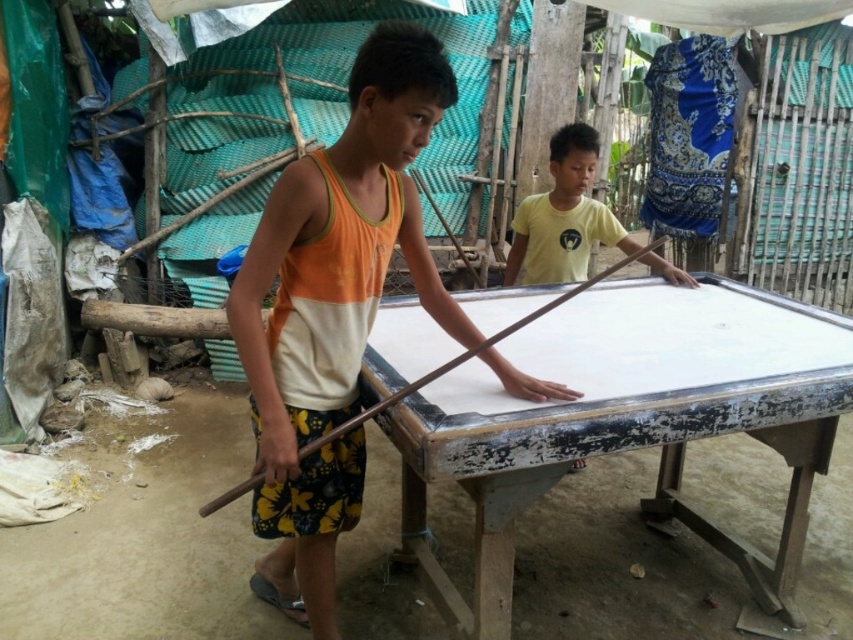
Question: Which object is closer to the camera taking this photo?

Choices:
 (A) white painted wood billiard table at center
 (B) brown wooden stick at center

Answer: (B)

Question: Can you confirm if orange and white tank top at center is bigger than brown wooden stick at center?

Choices:
 (A) no
 (B) yes

Answer: (B)

Question: Which object is the farthest from the orange and white tank top at center?

Choices:
 (A) brown wooden stick at center
 (B) white painted wood billiard table at center

Answer: (B)

Question: Does orange and white tank top at center appear on the left side of brown wooden stick at center?

Choices:
 (A) yes
 (B) no

Answer: (A)

Question: Estimate the real-world distances between objects in this image. Which object is closer to the white painted wood billiard table at center?

Choices:
 (A) orange and white tank top at center
 (B) brown wooden stick at center

Answer: (B)

Question: Where is white painted wood billiard table at center located in relation to brown wooden stick at center in the image?

Choices:
 (A) left
 (B) right

Answer: (B)